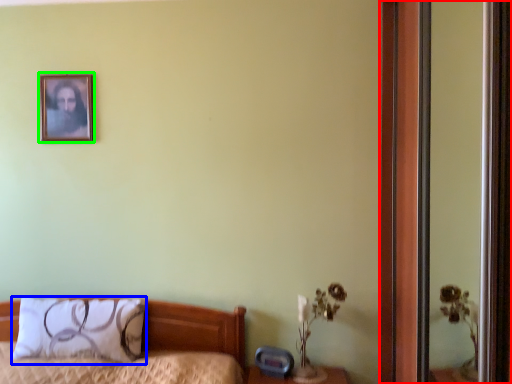
Question: Considering the real-world distances, which object is closest to screen door (highlighted by a red box)? pillow (highlighted by a blue box) or picture frame (highlighted by a green box).

Choices:
 (A) pillow
 (B) picture frame

Answer: (A)